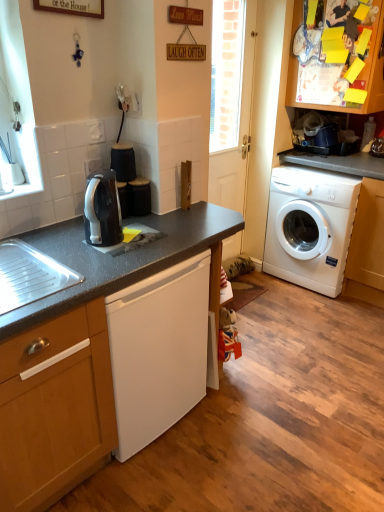
At what (x,y) coordinates should I click in order to perform the action: click on free space to the left of black glossy kettle at upper left. Please return your answer as a coordinate pair (x, y). Looking at the image, I should click on pyautogui.click(x=68, y=238).